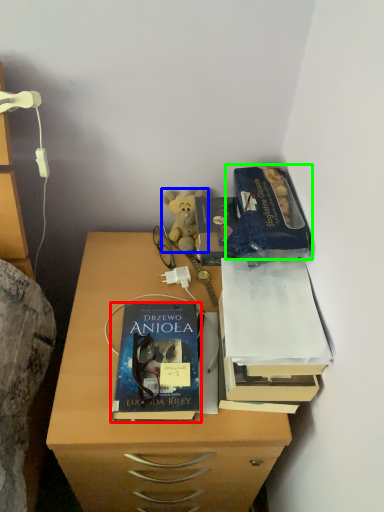
Question: Estimate the real-world distances between objects in this image. Which object is farther from book (highlighted by a red box), teddy bear (highlighted by a blue box) or paperback book (highlighted by a green box)?

Choices:
 (A) teddy bear
 (B) paperback book

Answer: (A)